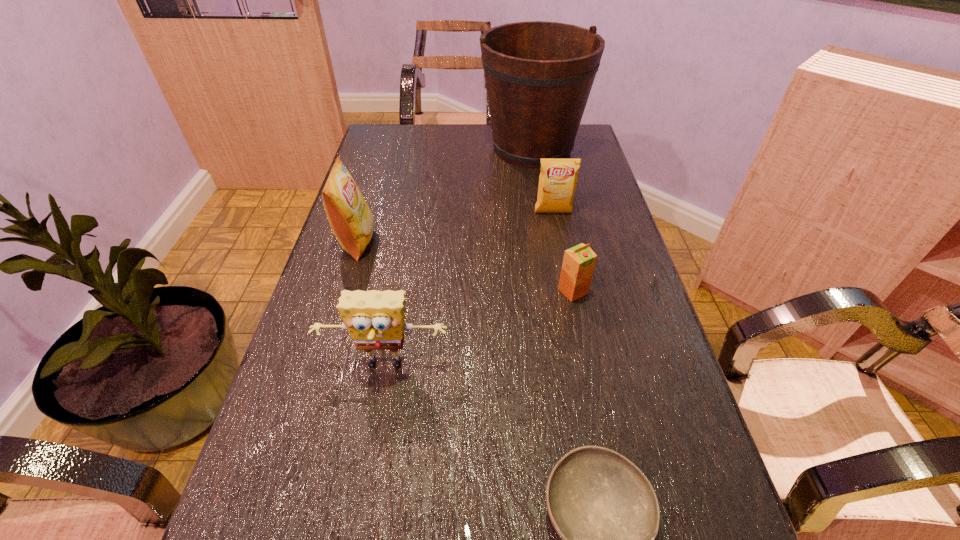
I want to click on object located in the far right corner section of the desktop, so click(x=538, y=75).

Image resolution: width=960 pixels, height=540 pixels. In order to click on vacant space at the left edge in this screenshot , I will do `click(336, 262)`.

Image resolution: width=960 pixels, height=540 pixels. I want to click on vacant space at the right edge, so click(x=579, y=178).

Image resolution: width=960 pixels, height=540 pixels. Find the location of `blank space at the far left corner of the desktop`. blank space at the far left corner of the desktop is located at coordinates (392, 137).

You are a GUI agent. You are given a task and a screenshot of the screen. Output one action in this format:
    pyautogui.click(x=<x>, y=<y>)
    Task: Click on the empty location between the left crisp (potato chip) and the farther crisp (potato chip)
    This screenshot has height=540, width=960.
    Given the screenshot: What is the action you would take?
    pyautogui.click(x=455, y=227)

Locate an element on the screen. vacant space that's between the second farthest object and the fifth farthest object is located at coordinates (469, 289).

Where is `free spot between the second shortest object and the bucket`? This screenshot has height=540, width=960. free spot between the second shortest object and the bucket is located at coordinates (553, 220).

Locate an element on the screen. free space between the fifth farthest object and the third nearest object is located at coordinates (479, 329).

The height and width of the screenshot is (540, 960). Find the location of `empty space that is in between the second nearest object and the farther crisp (potato chip)`. empty space that is in between the second nearest object and the farther crisp (potato chip) is located at coordinates (469, 289).

Identify the location of object that is the nearest to the right crisp (potato chip). The image size is (960, 540). (538, 75).